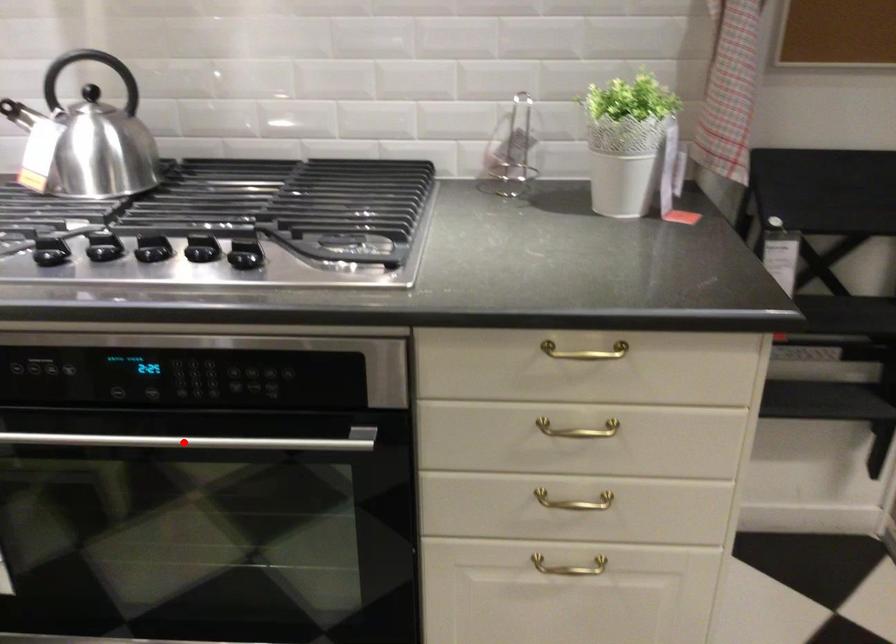
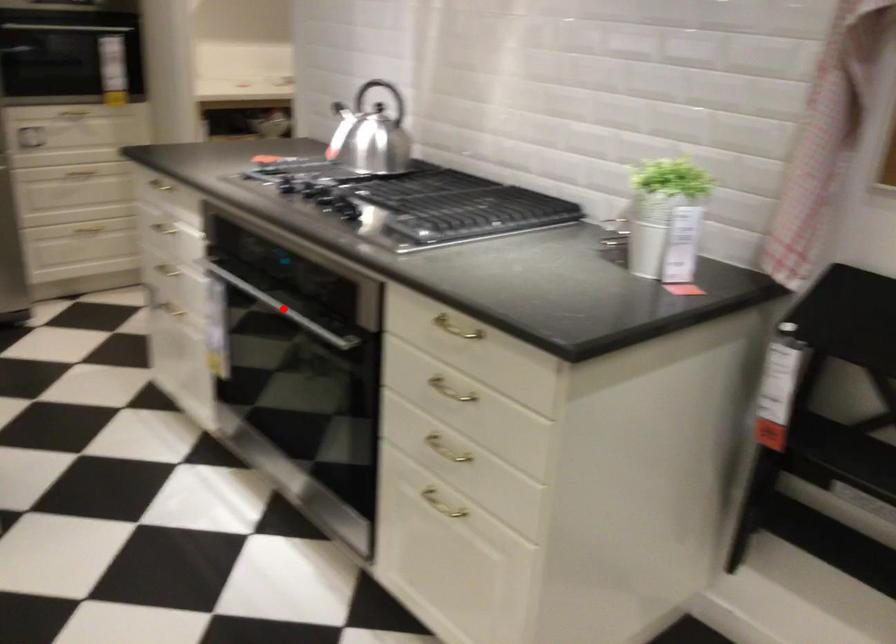
I am providing you with two images of the same scene from different viewpoints. A red point is marked on the first image and another point is marked on the second image. Is the marked point in image1 the same physical position as the marked point in image2?

Yes